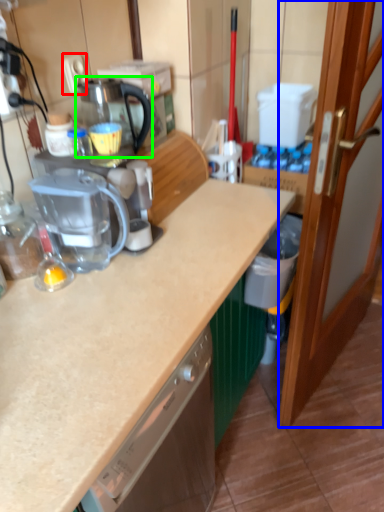
Question: Based on their relative distances, which object is farther from electric outlet (highlighted by a red box)? Choose from door (highlighted by a blue box) and coffeepot (highlighted by a green box).

Choices:
 (A) door
 (B) coffeepot

Answer: (A)